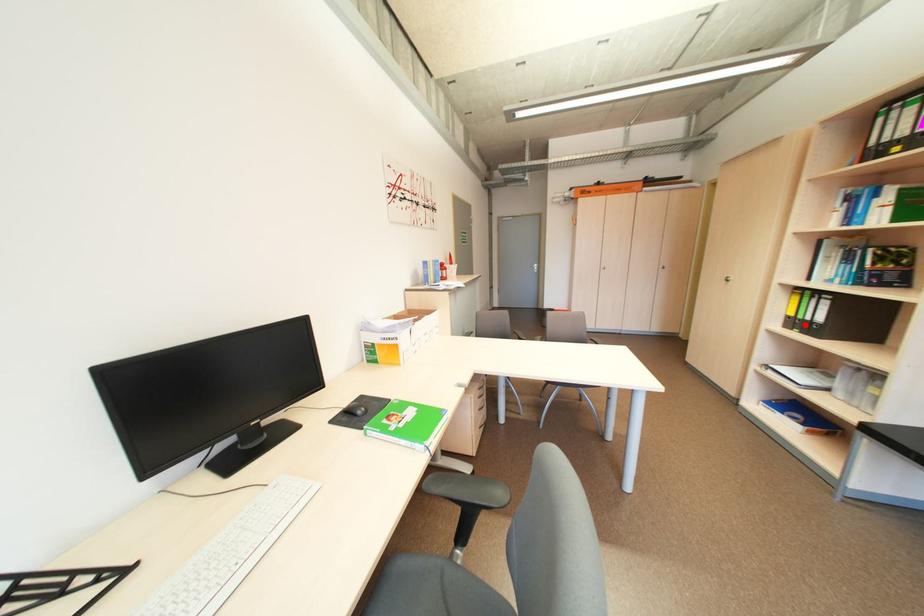
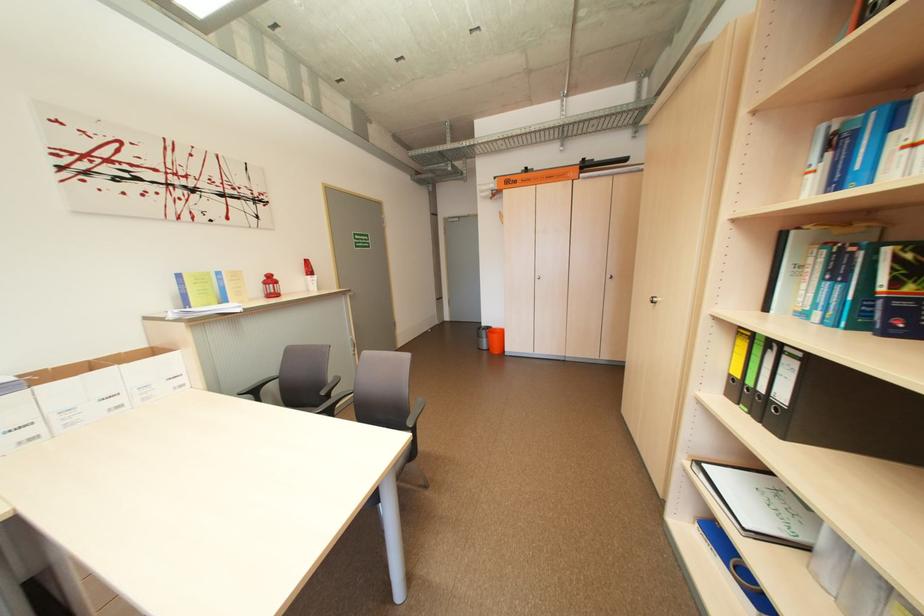
The point at the highlighted location is marked in the first image. Where is the corresponding point in the second image?

(754, 394)